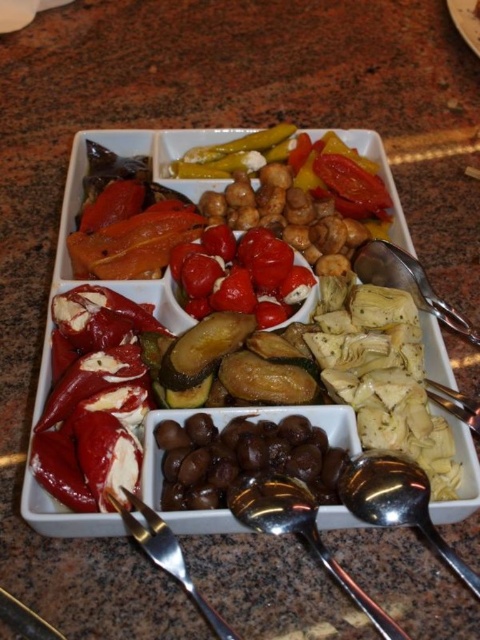
Which of these two, satin silver spoon at lower center or silver metallic fork at lower left, stands taller?

With more height is satin silver spoon at lower center.

Describe the element at coordinates (300, 532) in the screenshot. I see `satin silver spoon at lower center` at that location.

The height and width of the screenshot is (640, 480). I want to click on satin silver spoon at lower center, so click(300, 532).

How distant is shiny dark olives at center from silver metallic spoon at center-right?

shiny dark olives at center is 12.84 inches away from silver metallic spoon at center-right.

Who is lower down, shiny dark olives at center or silver metallic spoon at center-right?

shiny dark olives at center

You are a GUI agent. You are given a task and a screenshot of the screen. Output one action in this format:
    pyautogui.click(x=<x>, y=<y>)
    Task: Click on the shiny dark olives at center
    This screenshot has width=480, height=640.
    Given the screenshot: What is the action you would take?
    pyautogui.click(x=241, y=458)

Can you confirm if shiny dark olives at center is thinner than satin silver spoon at lower center?

No, shiny dark olives at center is not thinner than satin silver spoon at lower center.

Between shiny dark olives at center and satin silver spoon at lower center, which one is positioned higher?

shiny dark olives at center is above.

Measure the distance between point (237, 464) and camera.

They are 30.35 inches apart.

The width and height of the screenshot is (480, 640). I want to click on shiny dark olives at center, so click(241, 458).